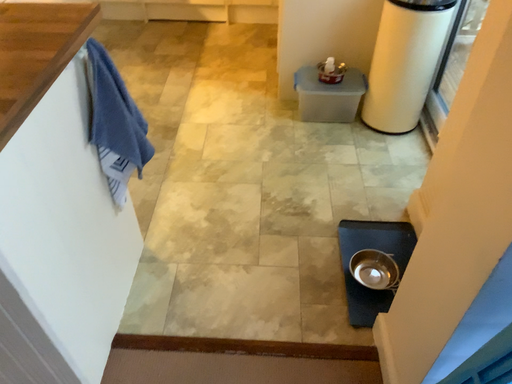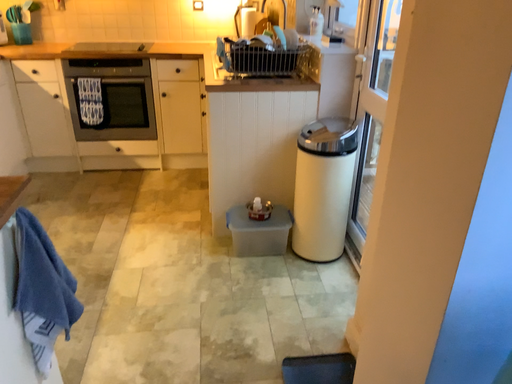
Question: How did the camera likely rotate when shooting the video?

Choices:
 (A) rotated downward
 (B) rotated upward

Answer: (B)